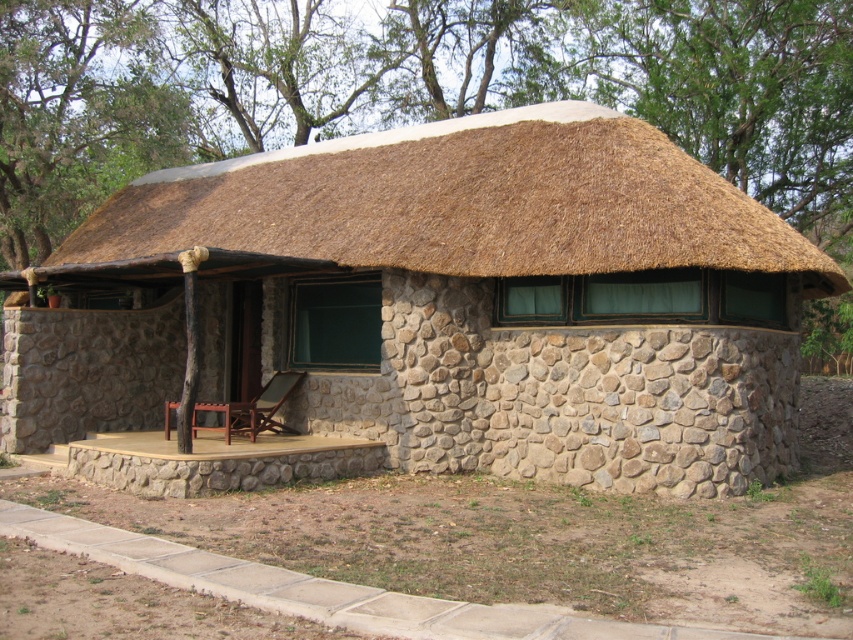
You are standing in front of the rustic stone cabin and want to determine which of the two points, point (x=222, y=374) or point (x=805, y=248), is closer to you. Based on the structure, which point is nearer?

Point (x=222, y=374) is closer to you because it is further to the viewer than point (x=805, y=248).

You are standing at the entrance of the rustic stone cabin and want to determine the relative positions of two points marked in the scene. Which of the two points, point 1 at coordinates [767,253] or point 2 at coordinates [254,433], is closer to you?

Point 1 at coordinates [767,253] is closer to you than point 2 at coordinates [254,433].

You are planning to install a solar panel on the tallest object in the stone textured hut at center and thatched straw roof at upper center. Which object should the solar panel be placed on?

The stone textured hut at center is taller than the thatched straw roof at upper center, so the solar panel should be placed on the stone textured hut at center.